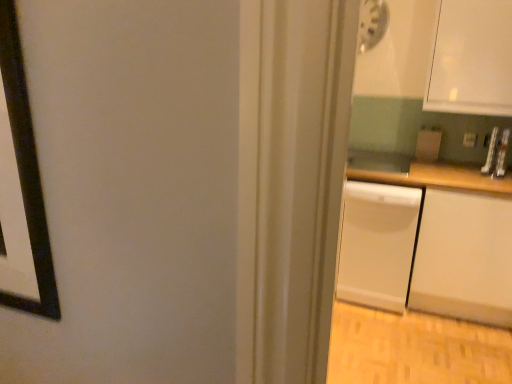
Question: Could you tell me if matte white dishwasher at right is turned towards white matte dishwasher at right?

Choices:
 (A) no
 (B) yes

Answer: (A)

Question: From a real-world perspective, is matte white dishwasher at right physically below white matte dishwasher at right?

Choices:
 (A) no
 (B) yes

Answer: (A)

Question: Is matte white dishwasher at right smaller than white matte dishwasher at right?

Choices:
 (A) no
 (B) yes

Answer: (B)

Question: Is matte white dishwasher at right next to white matte dishwasher at right?

Choices:
 (A) no
 (B) yes

Answer: (A)

Question: From a real-world perspective, is matte white dishwasher at right physically above white matte dishwasher at right?

Choices:
 (A) no
 (B) yes

Answer: (B)

Question: Is matte white dishwasher at right surrounding white matte dishwasher at right?

Choices:
 (A) no
 (B) yes

Answer: (A)

Question: From the image's perspective, is matte white dishwasher at right located above white matte counter at right?

Choices:
 (A) yes
 (B) no

Answer: (A)

Question: Can you confirm if matte white dishwasher at right is smaller than white matte counter at right?

Choices:
 (A) yes
 (B) no

Answer: (A)

Question: Is matte white dishwasher at right closer to the viewer compared to white matte counter at right?

Choices:
 (A) no
 (B) yes

Answer: (A)

Question: Does matte white dishwasher at right have a lesser height compared to white matte counter at right?

Choices:
 (A) yes
 (B) no

Answer: (A)

Question: Considering the relative positions of matte white dishwasher at right and white matte counter at right in the image provided, is matte white dishwasher at right to the left of white matte counter at right from the viewer's perspective?

Choices:
 (A) no
 (B) yes

Answer: (A)

Question: Is white matte counter at right a part of matte white dishwasher at right?

Choices:
 (A) yes
 (B) no

Answer: (B)

Question: Can you confirm if white matte counter at right is positioned to the right of matte white dishwasher at right?

Choices:
 (A) no
 (B) yes

Answer: (A)